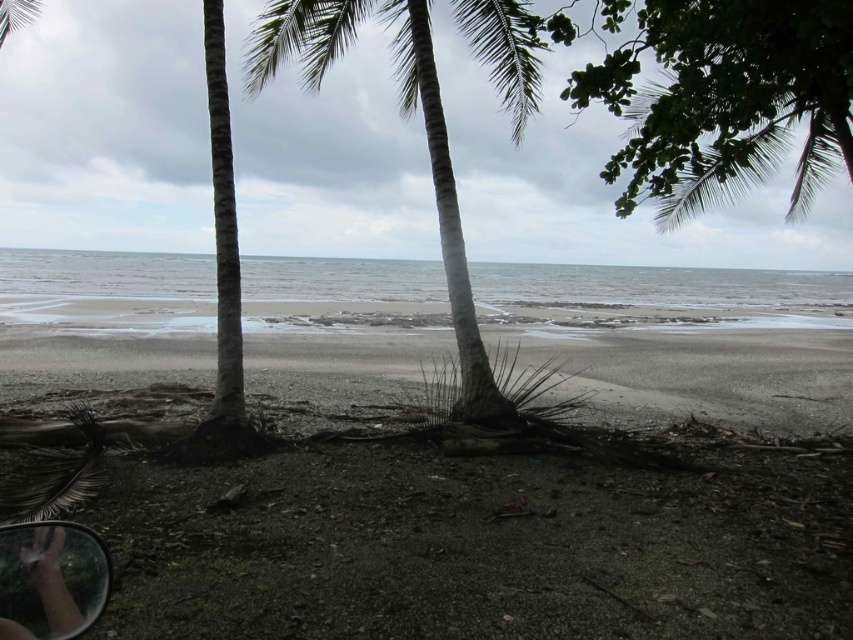
You are standing on the beach and want to take a photo of both point coordinates, point (495, 65) and point (91, 593). Which point will appear closer to the camera in your photo?

Point (91, 593) will appear closer to the camera in the photo because it is physically closer to the observer than point (495, 65), which is further away.

You are standing at point (477, 547) on the beach. What type of terrain are you currently standing on?

You are standing on dark sand at center.

You are standing on the beach and want to place a 3.5 meter long wooden board between the green leafy tree at upper right and the green leafy coconut tree at center. Will the board fit between them without bending?

The distance between the green leafy tree at upper right and the green leafy coconut tree at center is 3.41 meters, so the 3.5 meter long wooden board is slightly longer than the space available. It will not fit without bending.